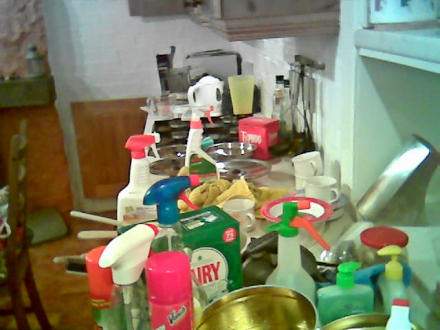
Where is `cushion`? Image resolution: width=440 pixels, height=330 pixels. cushion is located at coordinates (41, 227).